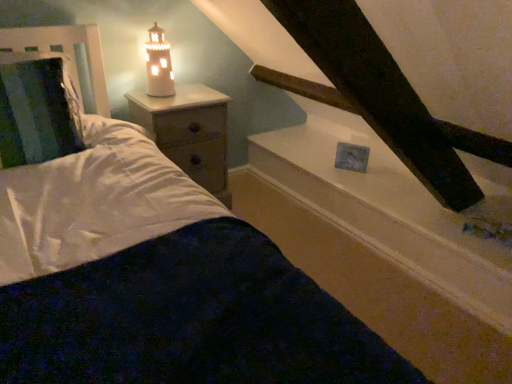
Locate an element on the screen. The width and height of the screenshot is (512, 384). free spot above wooden nightstand at left (from a real-world perspective) is located at coordinates (177, 102).